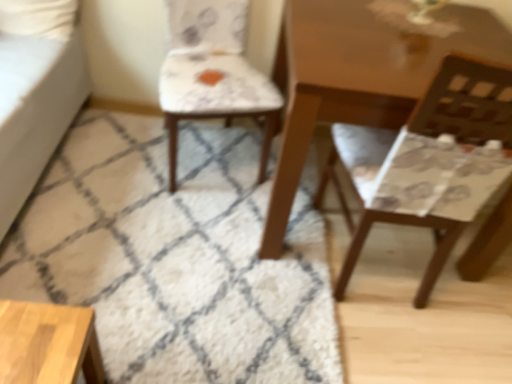
Question: Looking at their shapes, would you say patterned fabric chair at center, the first chair in the left-to-right sequence, is wider or thinner than matte brown chair at right, marked as the 1th chair in a right-to-left arrangement?

Choices:
 (A) thin
 (B) wide

Answer: (B)

Question: Does point (181, 41) appear closer or farther from the camera than point (451, 147)?

Choices:
 (A) closer
 (B) farther

Answer: (B)

Question: Estimate the real-world distances between objects in this image. Which object is farther from the white shaggy rug at center?

Choices:
 (A) patterned fabric chair at center, the second chair viewed from the right
 (B) matte brown chair at right, marked as the 1th chair in a right-to-left arrangement

Answer: (B)

Question: Which object is positioned closest to the matte brown chair at right, marked as the 1th chair in a right-to-left arrangement?

Choices:
 (A) white shaggy rug at center
 (B) patterned fabric chair at center, the second chair viewed from the right

Answer: (B)